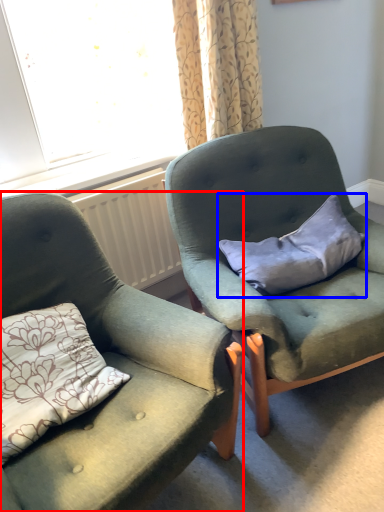
Question: Which of the following is the farthest to the observer, chair (highlighted by a red box) or pillow (highlighted by a blue box)?

Choices:
 (A) chair
 (B) pillow

Answer: (B)